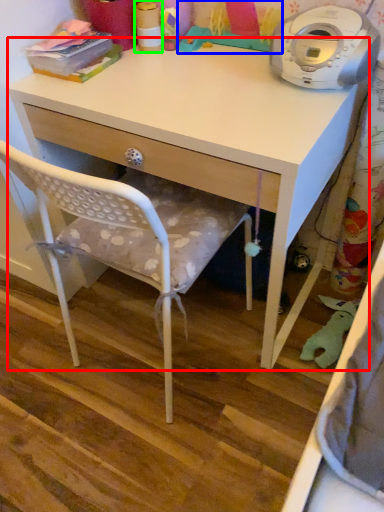
Question: Which object is the farthest from desk (highlighted by a red box)? Choose among these: toy (highlighted by a blue box) or toy (highlighted by a green box).

Choices:
 (A) toy
 (B) toy

Answer: (B)